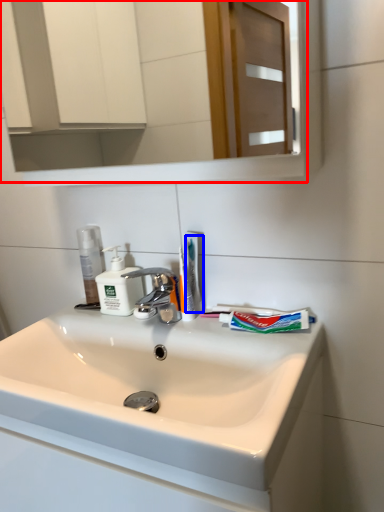
Question: Which of the following is the farthest to the observer, mirror (highlighted by a red box) or toothbrush (highlighted by a blue box)?

Choices:
 (A) mirror
 (B) toothbrush

Answer: (B)